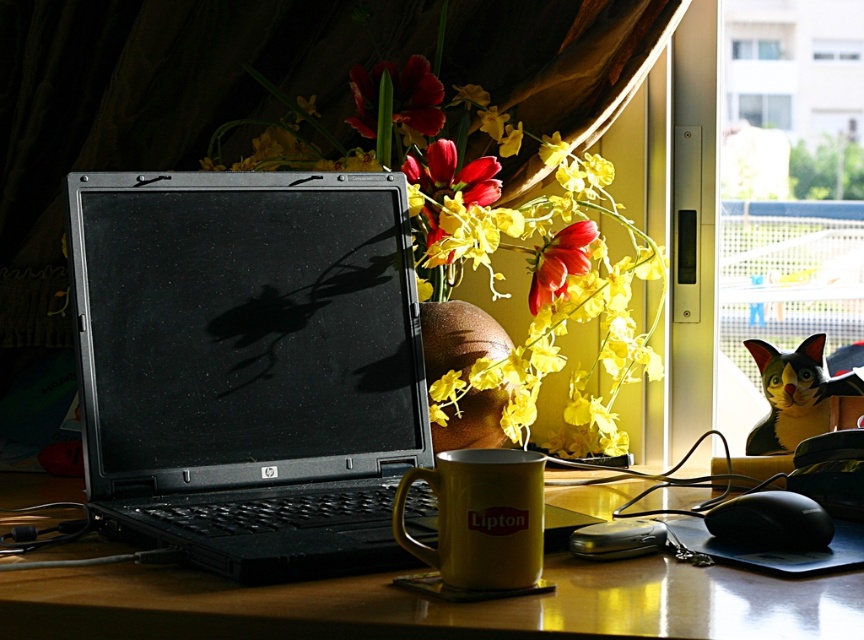
Looking at this image, is matte brown vase at center to the right of matte red flower at center from the viewer's perspective?

Correct, you'll find matte brown vase at center to the right of matte red flower at center.

Is matte brown vase at center shorter than matte red flower at center?

Incorrect, matte brown vase at center's height does not fall short of matte red flower at center's.

Find the location of `matte brown vase at center`. matte brown vase at center is located at coordinates (458, 337).

This screenshot has width=864, height=640. What are the coordinates of `black plastic laptop at center` in the screenshot? It's located at (246, 365).

Who is more forward, (410, 340) or (785, 294)?

Positioned in front is point (410, 340).

Find the location of `black plastic laptop at center`. black plastic laptop at center is located at coordinates (246, 365).

Identify the location of black plastic laptop at center. (246, 365).

Which is in front, point (395, 516) or point (378, 112)?

Point (395, 516)

Between yellow matte mug at center and matte red flower at center, which one has more height?

yellow matte mug at center

Who is more distant from viewer, (469,449) or (415,88)?

The point (415,88) is behind.

Locate an element on the screen. yellow matte mug at center is located at coordinates (480, 516).